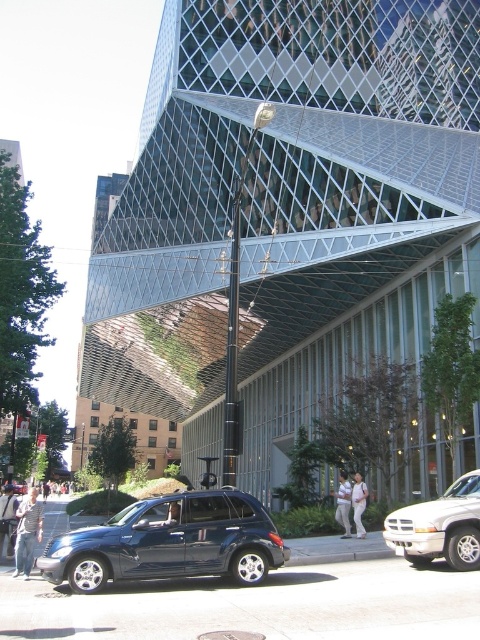
Question: Is matte dark blue suv at lower left thinner than shiny dark blue sedan at center?

Choices:
 (A) no
 (B) yes

Answer: (B)

Question: Is matte dark blue suv at lower left positioned in front of silver metallic truck at lower right?

Choices:
 (A) no
 (B) yes

Answer: (B)

Question: Based on their relative distances, which object is farther from the shiny dark blue sedan at center?

Choices:
 (A) silver metallic truck at lower right
 (B) matte dark blue suv at lower left

Answer: (A)

Question: Based on their relative distances, which object is farther from the silver metallic truck at lower right?

Choices:
 (A) shiny dark blue sedan at center
 (B) matte dark blue suv at lower left

Answer: (A)

Question: Which of the following is the farthest from the observer?

Choices:
 (A) silver metallic truck at lower right
 (B) shiny dark blue sedan at center

Answer: (B)

Question: Is silver metallic truck at lower right to the right of shiny dark blue sedan at center from the viewer's perspective?

Choices:
 (A) no
 (B) yes

Answer: (B)